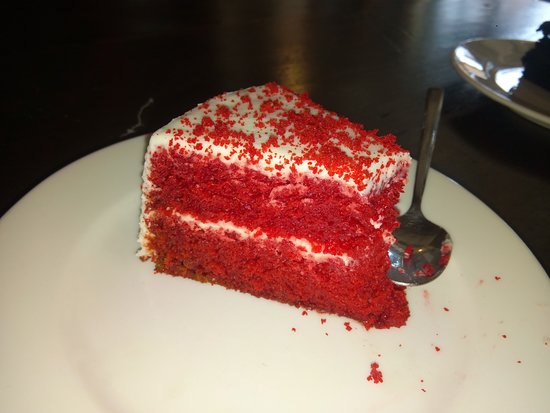
The height and width of the screenshot is (413, 550). Find the location of `wooden talbe`. wooden talbe is located at coordinates (317, 44).